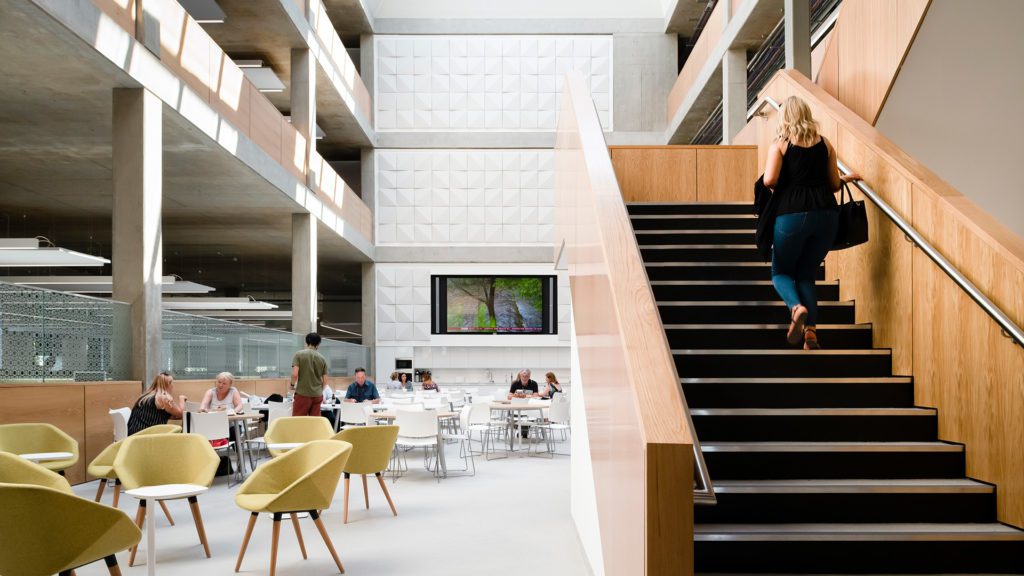
Identify the location of number of yellow chairs. The height and width of the screenshot is (576, 1024). (48, 532), (43, 447), (99, 461), (164, 472), (289, 424), (387, 449), (307, 471).